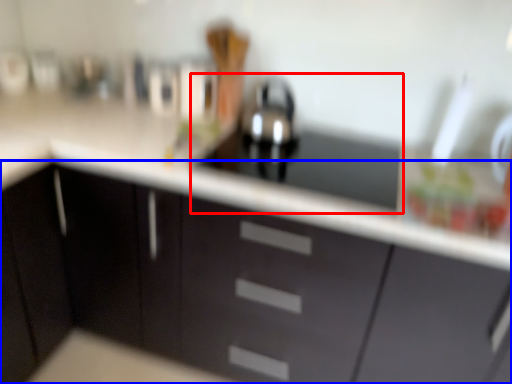
Question: Which object appears closest to the camera in this image, sink (highlighted by a red box) or cabinetry (highlighted by a blue box)?

Choices:
 (A) sink
 (B) cabinetry

Answer: (B)